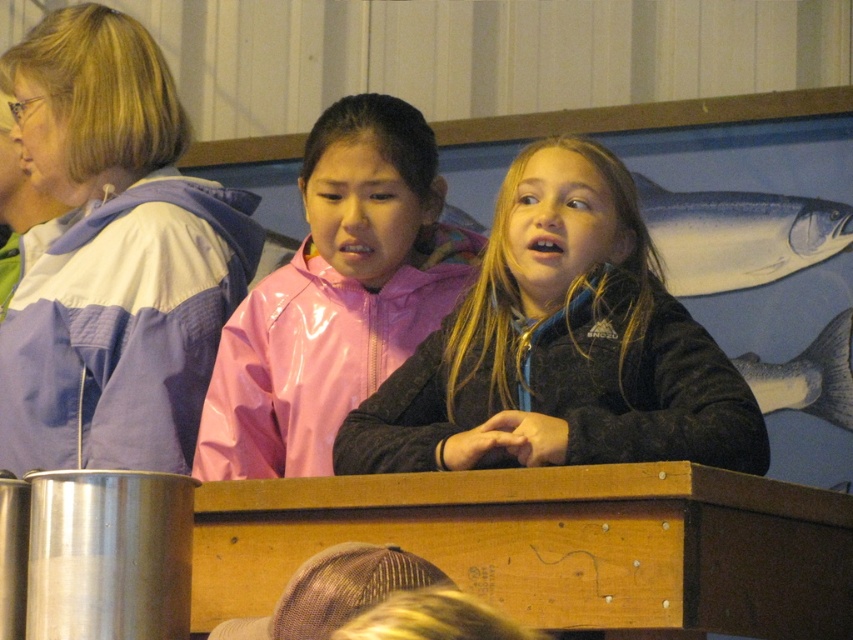
Is pink glossy jacket at center to the right of shiny silver fish at upper right from the viewer's perspective?

Incorrect, pink glossy jacket at center is not on the right side of shiny silver fish at upper right.

Does pink glossy jacket at center appear on the left side of shiny silver fish at upper right?

Yes, pink glossy jacket at center is to the left of shiny silver fish at upper right.

Who is more distant from viewer, (402,282) or (810,364)?

Positioned behind is point (810,364).

Locate an element on the screen. The height and width of the screenshot is (640, 853). pink glossy jacket at center is located at coordinates (335, 296).

Looking at this image, can you confirm if blue glossy fish at upper right is thinner than shiny silver fish at upper right?

Incorrect, blue glossy fish at upper right's width is not less than shiny silver fish at upper right's.

Can you confirm if blue glossy fish at upper right is positioned below shiny silver fish at upper right?

No.

Between point (769, 205) and point (819, 385), which one is positioned in front?

Point (819, 385)

The height and width of the screenshot is (640, 853). Identify the location of blue glossy fish at upper right. (737, 236).

Is matte black jacket at center wider than shiny silver fish at upper right?

Indeed, matte black jacket at center has a greater width compared to shiny silver fish at upper right.

This screenshot has height=640, width=853. Describe the element at coordinates (560, 346) in the screenshot. I see `matte black jacket at center` at that location.

The width and height of the screenshot is (853, 640). In order to click on matte black jacket at center in this screenshot , I will do `click(560, 346)`.